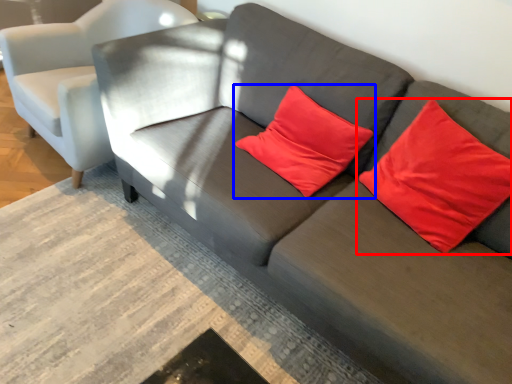
Question: Which point is closer to the camera, pillow (highlighted by a red box) or pillow (highlighted by a blue box)?

Choices:
 (A) pillow
 (B) pillow

Answer: (A)